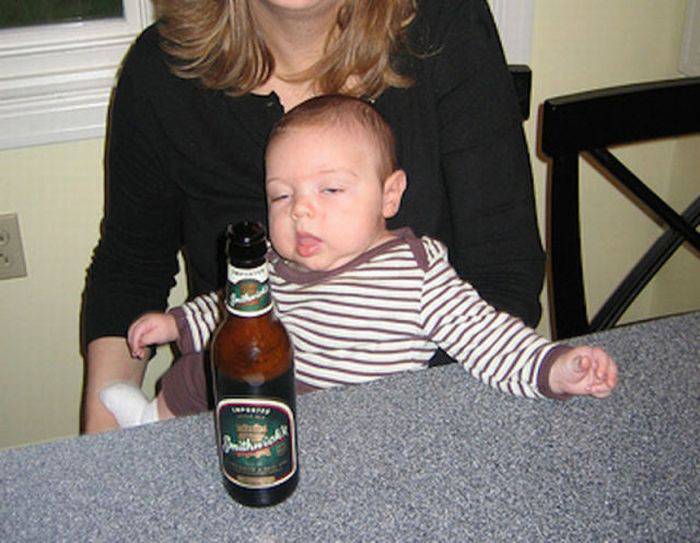
Find the location of a particular element. This screenshot has width=700, height=543. windowsill is located at coordinates (22, 50).